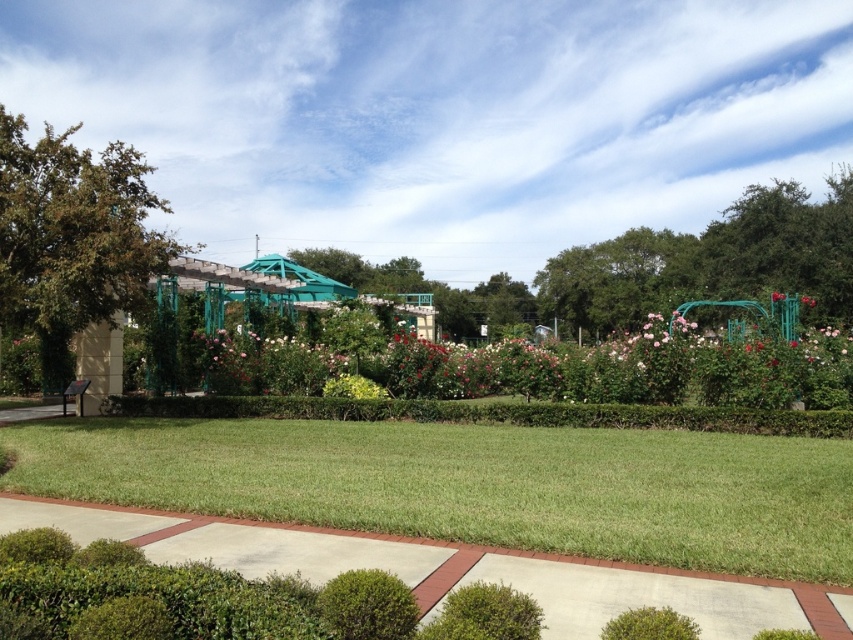
Measure the distance between green metal trellis at center and camera.

green metal trellis at center is 102.90 feet away from camera.

Which is below, green metal trellis at center or green leafy tree at center?

green leafy tree at center is below.

Where is `green metal trellis at center`? green metal trellis at center is located at coordinates (691, 264).

Locate an element on the screen. green metal trellis at center is located at coordinates (691, 264).

Is green leafy bush at center taller than pink matte rose at center-right?

In fact, green leafy bush at center may be shorter than pink matte rose at center-right.

Is green leafy bush at center further to the viewer compared to pink matte rose at center-right?

No, green leafy bush at center is in front of pink matte rose at center-right.

The width and height of the screenshot is (853, 640). Identify the location of green leafy bush at center. (485, 614).

The width and height of the screenshot is (853, 640). I want to click on green leafy bush at center, so click(485, 614).

Who is more distant from viewer, (712, 570) or (770, 298)?

The point (770, 298) is more distant.

You are a GUI agent. You are given a task and a screenshot of the screen. Output one action in this format:
    pyautogui.click(x=<x>, y=<y>)
    Task: Click on the green grass at center
    
    Given the screenshot: What is the action you would take?
    pyautogui.click(x=474, y=484)